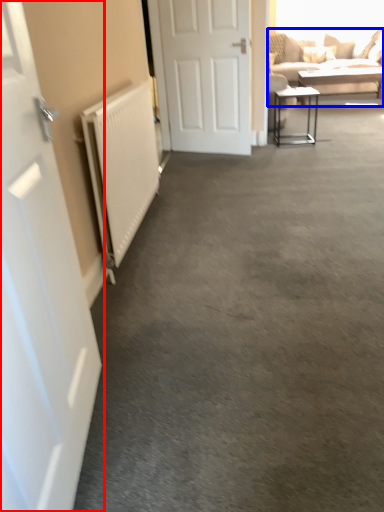
Question: Which object appears closest to the camera in this image, door (highlighted by a red box) or studio couch (highlighted by a blue box)?

Choices:
 (A) door
 (B) studio couch

Answer: (A)